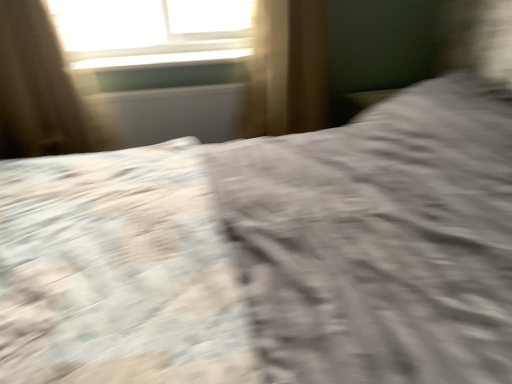
Question: From a real-world perspective, is brown fabric curtain at upper left above or below textured gray sheet at center?

Choices:
 (A) above
 (B) below

Answer: (A)

Question: Is brown fabric curtain at upper left taller or shorter than textured gray sheet at center?

Choices:
 (A) short
 (B) tall

Answer: (B)

Question: Estimate the real-world distances between objects in this image. Which object is closer to the white glossy window sill at upper center?

Choices:
 (A) brown fabric curtain at upper left
 (B) textured gray sheet at center

Answer: (A)

Question: Based on their relative distances, which object is nearer to the brown fabric curtain at upper left?

Choices:
 (A) textured gray sheet at center
 (B) white glossy window sill at upper center

Answer: (B)